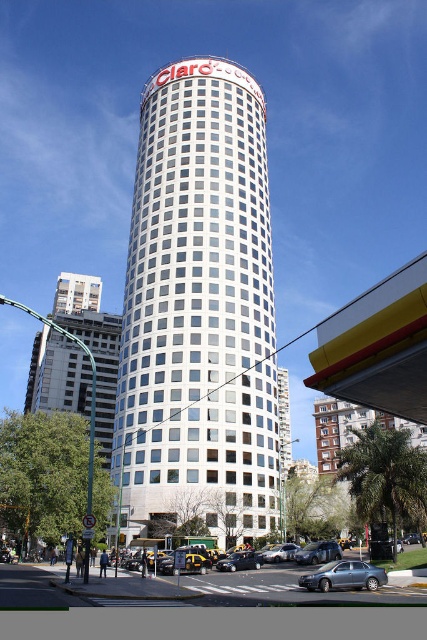
You are standing at the intersection and see the white glass tower at center and the yellow rubber taxi at lower center. Which object is positioned to the left from your viewpoint?

The white glass tower at center is to the left of the yellow rubber taxi at lower center from your viewpoint.

You are a pedestrian standing at the sidewalk in this urban scene. You see a yellow rubber taxi at lower center and a metallic silver car at center. Which vehicle is closer to you?

The yellow rubber taxi at lower center is closer to you because it is positioned over the metallic silver car at center, indicating it is in front.

You are standing in the middle of the street looking at the white glass tower at center and the yellow rubber taxi at lower center. Which object is closer to you?

The white glass tower at center is closer to you because it is further to the viewer than the yellow rubber taxi at lower center.